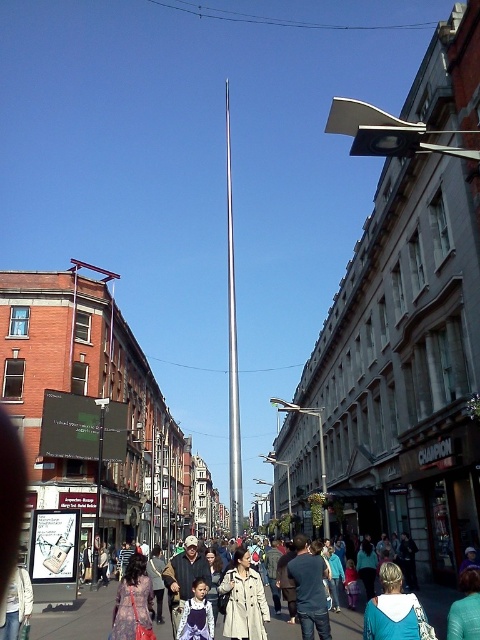
You are a tourist standing on the street looking at the silver metallic flag pole at center and the teal hoodie at lower right. Which object is taller?

The silver metallic flag pole at center is much taller than the teal hoodie at lower right.